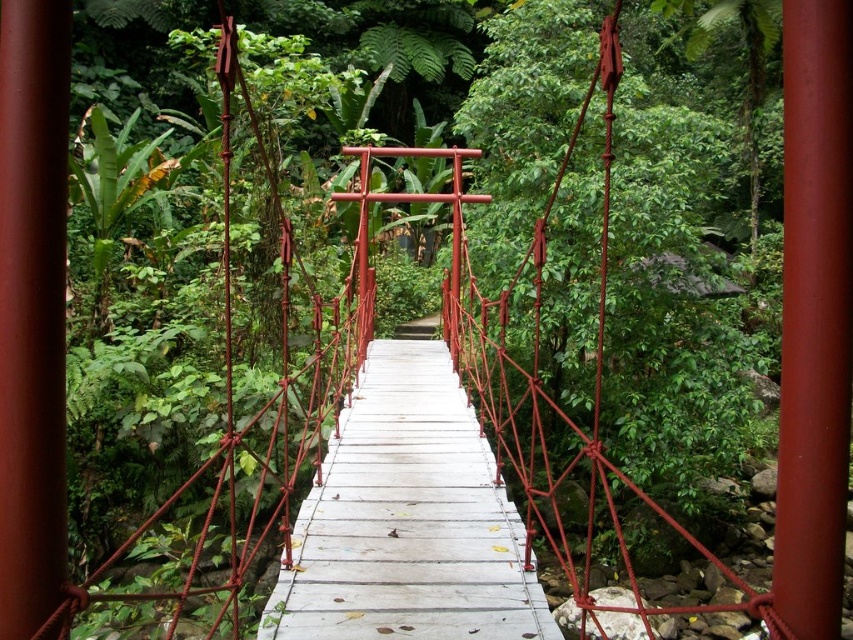
Question: Does smooth glossy red pole at center appear on the left side of smooth red pole at center?

Choices:
 (A) no
 (B) yes

Answer: (A)

Question: Based on their relative distances, which object is nearer to the smooth glossy red pole at center?

Choices:
 (A) smooth red pole at center
 (B) white wooden bridge at center

Answer: (A)

Question: Estimate the real-world distances between objects in this image. Which object is farther from the smooth red pole at center?

Choices:
 (A) smooth glossy red pole at center
 (B) white wooden bridge at center

Answer: (B)

Question: Is smooth glossy red pole at center above smooth red pole at center?

Choices:
 (A) yes
 (B) no

Answer: (B)

Question: Which point is farther to the camera?

Choices:
 (A) (778, 540)
 (B) (381, 433)
 (C) (10, 611)

Answer: (B)

Question: Where is smooth glossy red pole at center located in relation to smooth red pole at center in the image?

Choices:
 (A) right
 (B) left

Answer: (A)